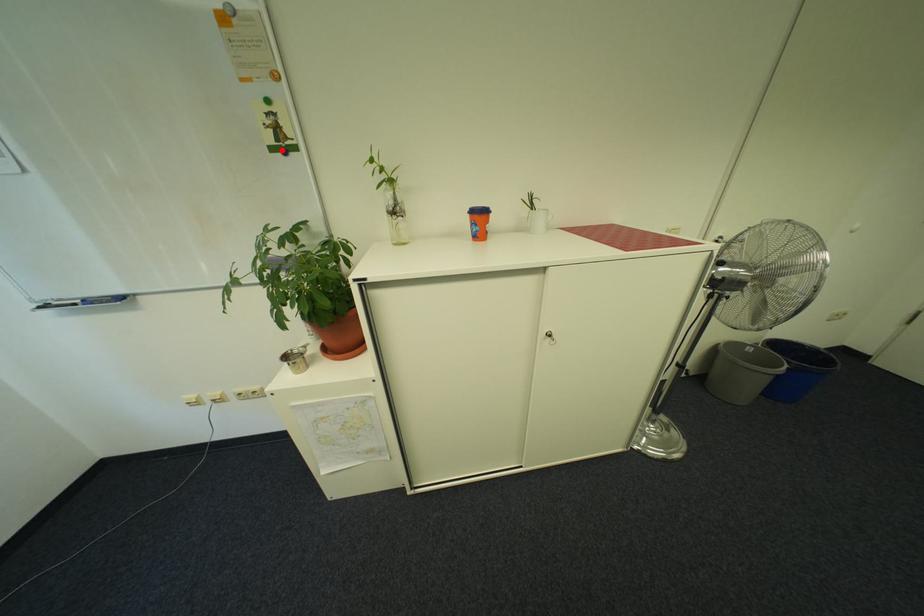
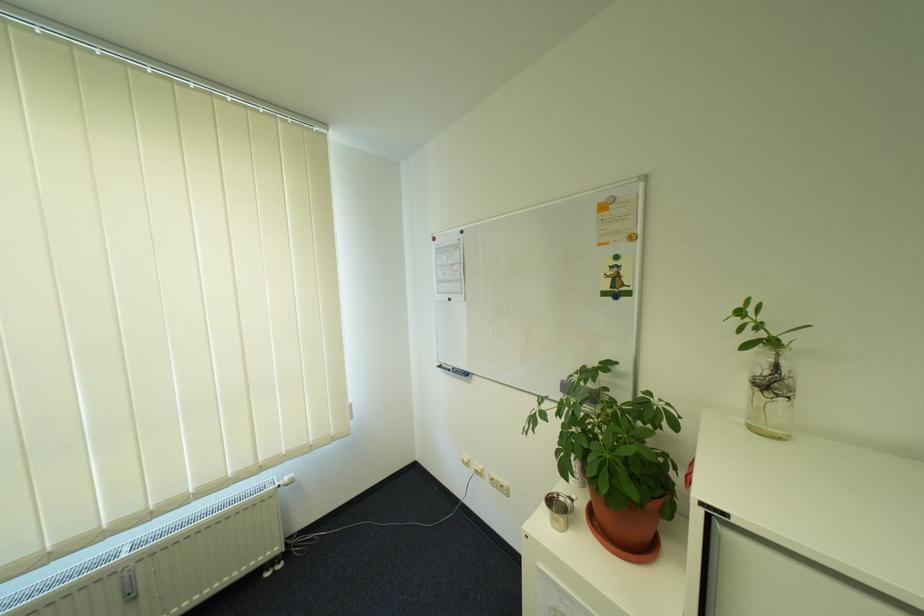
Question: I am providing you with two images of the same scene from different viewpoints. A red point is marked on the first image. Is the red point's position out of view in image 2?

Choices:
 (A) Yes
 (B) No

Answer: (B)